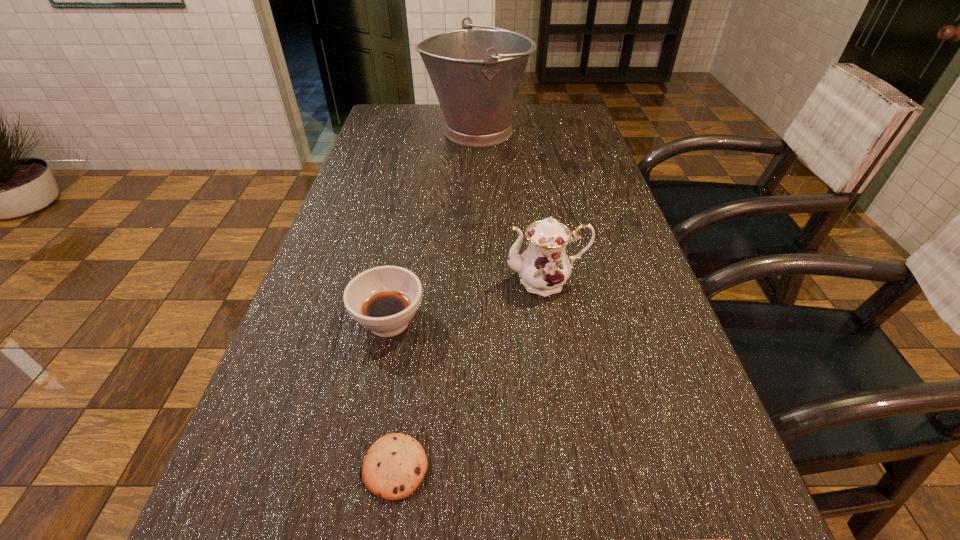
The width and height of the screenshot is (960, 540). Identify the location of the farthest object. (476, 73).

Locate an element on the screen. the tallest object is located at coordinates pyautogui.click(x=476, y=73).

Locate an element on the screen. chinaware is located at coordinates (544, 267).

I want to click on soup bowl, so click(x=384, y=299).

Where is `the fourth farthest object`? The height and width of the screenshot is (540, 960). the fourth farthest object is located at coordinates (395, 465).

Identify the location of cookie. (395, 465).

The width and height of the screenshot is (960, 540). In order to click on vacant space located on the front of the tallest object in this screenshot , I will do `click(476, 181)`.

What are the coordinates of `vacant area situated 0.200m on the back of the second tallest object` in the screenshot? It's located at (535, 214).

I want to click on free location located on the right of the soup bowl, so click(x=486, y=322).

The width and height of the screenshot is (960, 540). What are the coordinates of `free space located 0.120m on the back of the cookie` in the screenshot? It's located at (409, 373).